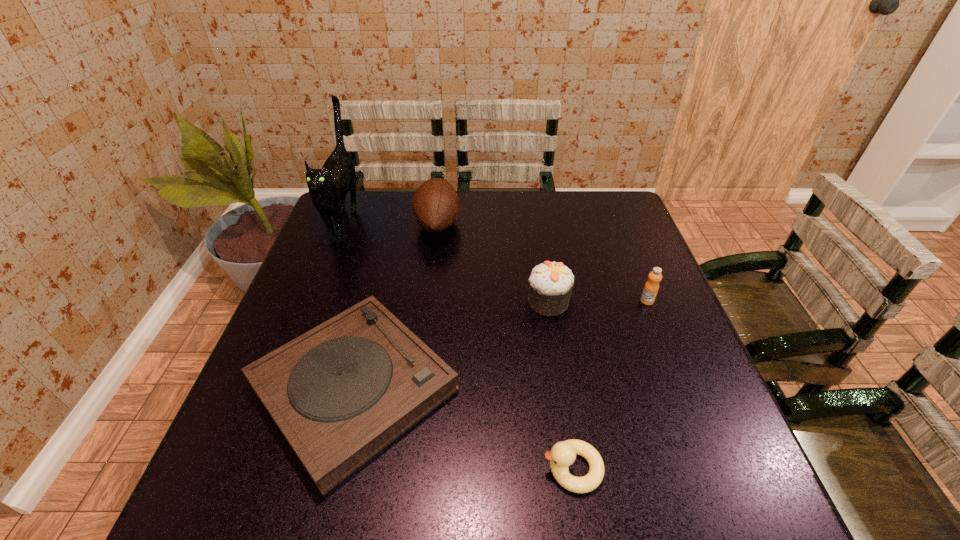
Where is `vacant region that satisfies the following two spatial constraints: 1. on the face of the cat; 2. on the left side of the cupcake`? The height and width of the screenshot is (540, 960). vacant region that satisfies the following two spatial constraints: 1. on the face of the cat; 2. on the left side of the cupcake is located at coordinates (312, 301).

You are a GUI agent. You are given a task and a screenshot of the screen. Output one action in this format:
    pyautogui.click(x=<x>, y=<y>)
    Task: Click on the vacant position in the image that satisfies the following two spatial constraints: 1. on the face of the tallest object; 2. on the right side of the shortest object
    The width and height of the screenshot is (960, 540).
    Given the screenshot: What is the action you would take?
    pyautogui.click(x=278, y=387)

Where is `vacant space that satisfies the following two spatial constraints: 1. on the face of the tallest object; 2. on the right side of the shortest object`? vacant space that satisfies the following two spatial constraints: 1. on the face of the tallest object; 2. on the right side of the shortest object is located at coordinates (278, 387).

This screenshot has height=540, width=960. Find the location of `free space that satisfies the following two spatial constraints: 1. on the face of the cupcake; 2. on the left side of the tallest object`. free space that satisfies the following two spatial constraints: 1. on the face of the cupcake; 2. on the left side of the tallest object is located at coordinates (312, 301).

Where is `free region that satisfies the following two spatial constraints: 1. on the face of the cat; 2. on the left side of the cupcake`? This screenshot has width=960, height=540. free region that satisfies the following two spatial constraints: 1. on the face of the cat; 2. on the left side of the cupcake is located at coordinates (312, 301).